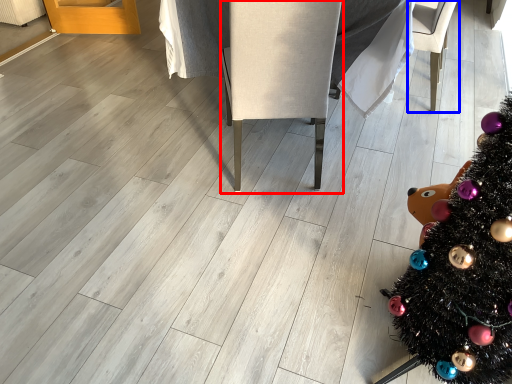
Question: Which point is further to the camera, armchair (highlighted by a red box) or armchair (highlighted by a blue box)?

Choices:
 (A) armchair
 (B) armchair

Answer: (B)